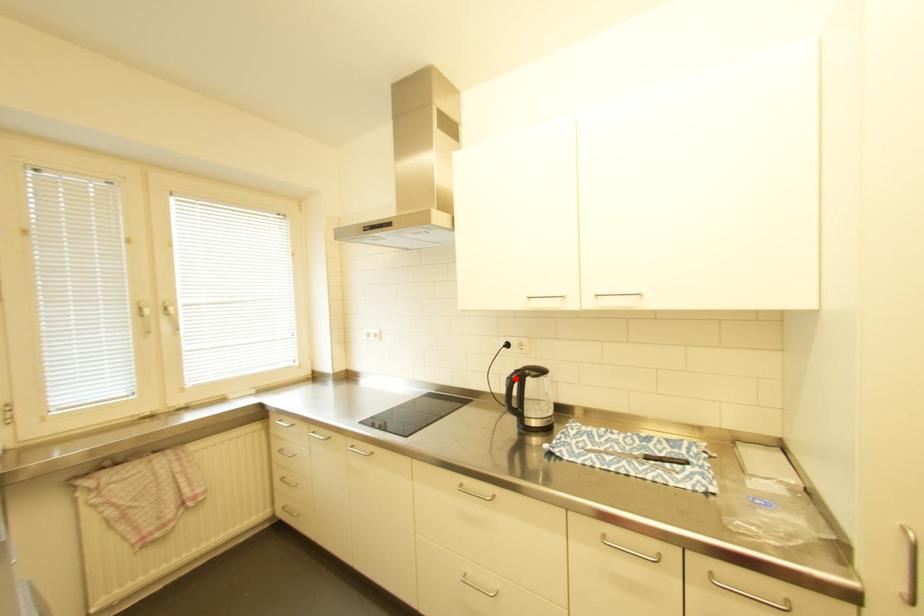
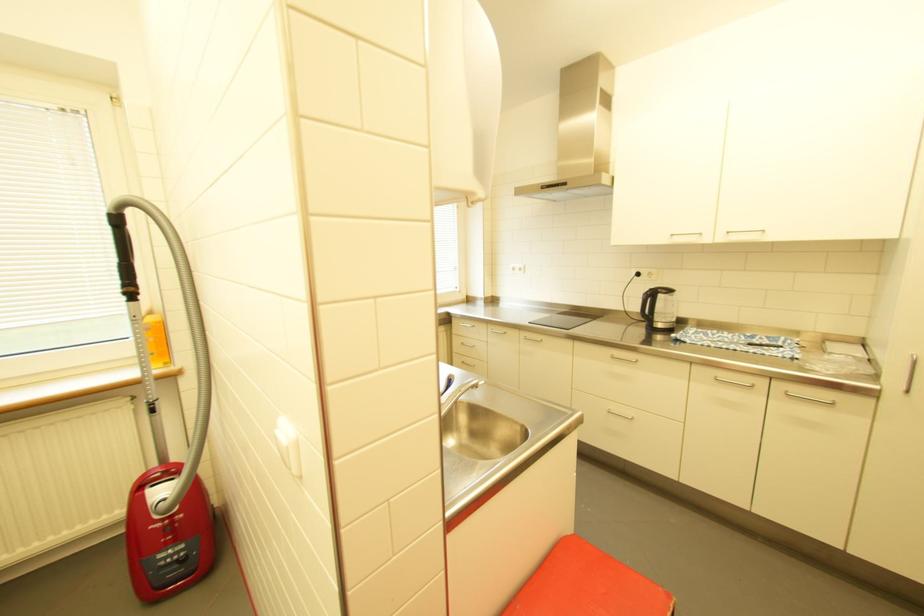
The point at the highlighted location is marked in the first image. Where is the corresponding point in the second image?

(651, 294)